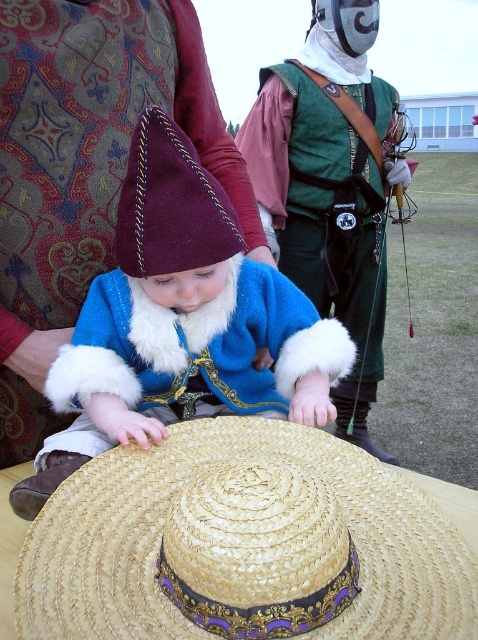
Question: Which point is farther to the camera?

Choices:
 (A) (235, 225)
 (B) (231, 236)

Answer: (A)

Question: Can you confirm if green leather armor at center is positioned below natural straw hat at center?

Choices:
 (A) no
 (B) yes

Answer: (A)

Question: Is the position of woven straw sombrero at center less distant than that of maroon felt hat at center?

Choices:
 (A) yes
 (B) no

Answer: (A)

Question: Which object appears farthest from the camera in this image?

Choices:
 (A) maroon felt hat at center
 (B) natural straw hat at center
 (C) green leather armor at center

Answer: (C)

Question: Considering the real-world distances, which object is closest to the green leather armor at center?

Choices:
 (A) maroon felt hat at center
 (B) natural straw hat at center
 (C) woven straw sombrero at center

Answer: (A)

Question: Is maroon felt hat at center in front of natural straw hat at center?

Choices:
 (A) yes
 (B) no

Answer: (A)